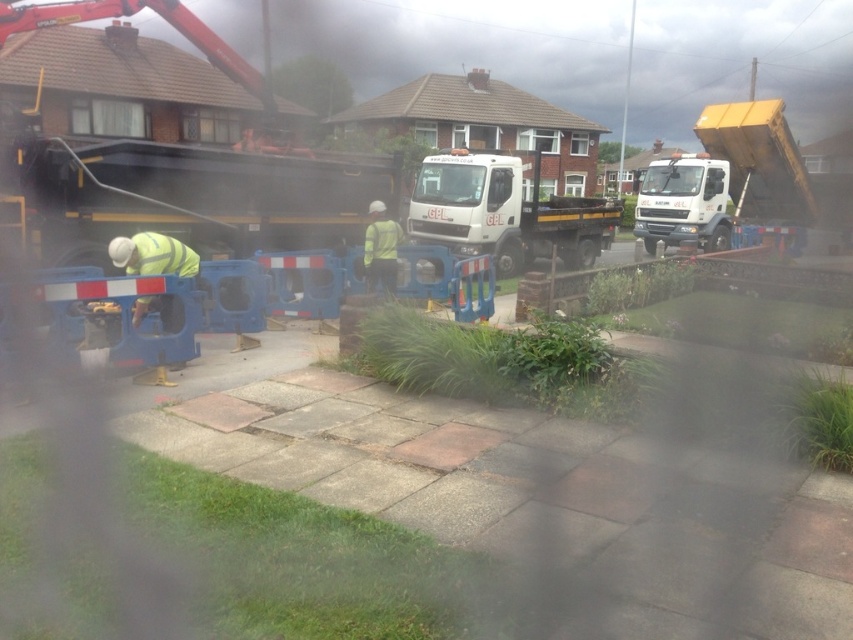
Between blue plastic barrier at center and yellow matte truck at upper right, which one appears on the left side from the viewer's perspective?

From the viewer's perspective, blue plastic barrier at center appears more on the left side.

Where is `blue plastic barrier at center`? blue plastic barrier at center is located at coordinates (550, 484).

Which is behind, point (503, 461) or point (647, 170)?

Point (647, 170)

This screenshot has height=640, width=853. Identify the location of blue plastic barrier at center. (550, 484).

From the picture: Is yellow matte truck at upper right shorter than white matte truck at center?

Yes, yellow matte truck at upper right is shorter than white matte truck at center.

Is yellow matte truck at upper right closer to camera compared to white matte truck at center?

No, yellow matte truck at upper right is behind white matte truck at center.

Between point (751, 161) and point (505, 243), which one is positioned in front?

Point (505, 243) is in front.

At what (x,y) coordinates should I click in order to perform the action: click on yellow matte truck at upper right. Please return your answer as a coordinate pair (x, y). Looking at the image, I should click on (724, 179).

How much distance is there between blue plastic barrier at center and white matte truck at center?

blue plastic barrier at center is 15.08 meters from white matte truck at center.

Can you confirm if blue plastic barrier at center is positioned below white matte truck at center?

Indeed, blue plastic barrier at center is positioned under white matte truck at center.

Image resolution: width=853 pixels, height=640 pixels. Identify the location of blue plastic barrier at center. (550, 484).